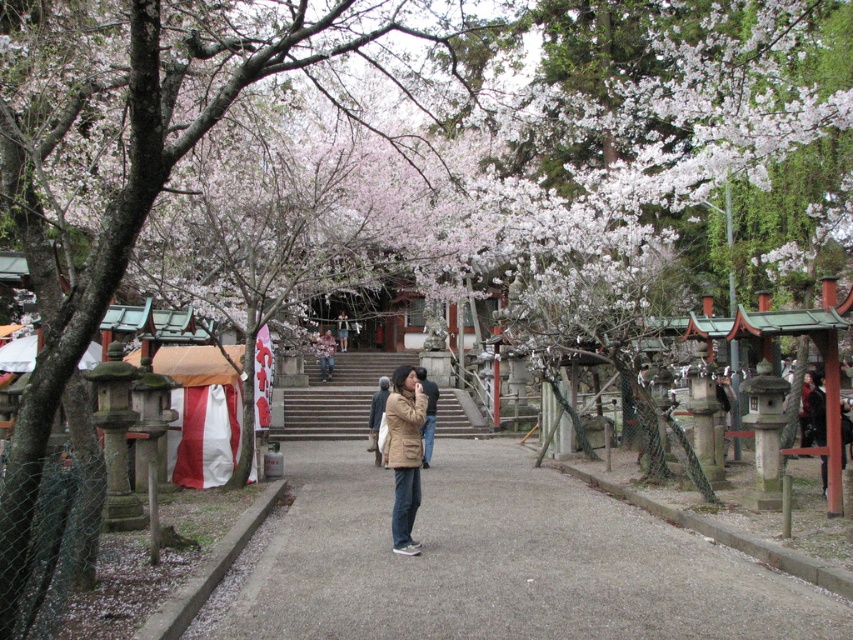
Does brown matte jacket at center have a lesser height compared to brown leather jacket at center?

Yes, brown matte jacket at center is shorter than brown leather jacket at center.

Is brown matte jacket at center closer to the viewer compared to brown leather jacket at center?

That is True.

The height and width of the screenshot is (640, 853). I want to click on brown matte jacket at center, so click(404, 452).

The image size is (853, 640). What are the coordinates of `brown matte jacket at center` in the screenshot? It's located at (404, 452).

Is point (397, 596) positioned behind point (401, 486)?

That is False.

Does gray gravel pavement at center have a lesser width compared to brown matte jacket at center?

Incorrect, gray gravel pavement at center's width is not less than brown matte jacket at center's.

Between point (341, 621) and point (405, 433), which one is positioned behind?

Point (405, 433)

Locate an element on the screen. gray gravel pavement at center is located at coordinates (492, 561).

Consider the image. Does gray gravel pavement at center appear on the right side of brown leather jacket at center?

Correct, you'll find gray gravel pavement at center to the right of brown leather jacket at center.

Is gray gravel pavement at center bigger than brown leather jacket at center?

Indeed, gray gravel pavement at center has a larger size compared to brown leather jacket at center.

Is point (335, 465) positioned before point (427, 387)?

No, it is behind (427, 387).

Identify the location of gray gravel pavement at center. The image size is (853, 640). (492, 561).